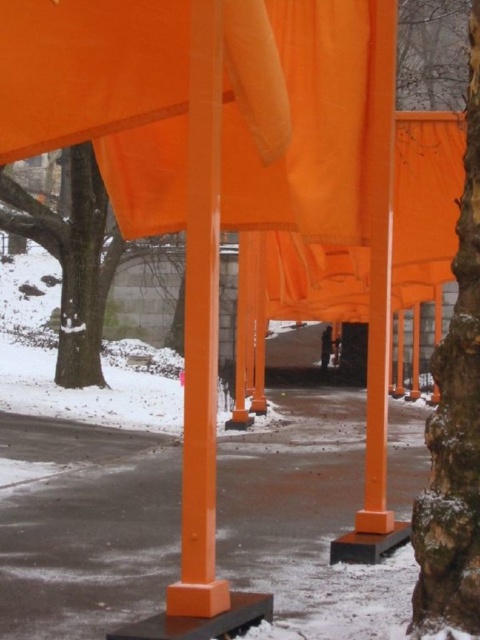
You are standing at the center of the installation and looking towards the right side. There is a point marked at coordinates point (456, 417). What object does this point correspond to?

The point (456, 417) corresponds to the smooth bark tree at right.